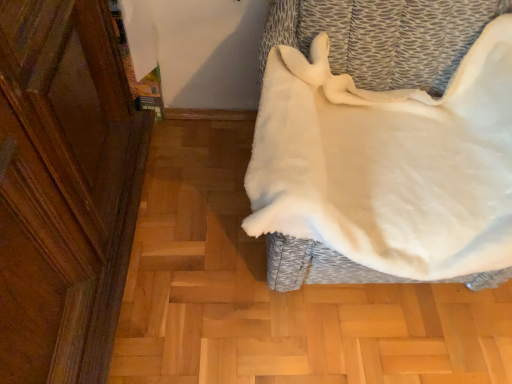
Identify the location of white soft blanket at upper right. (384, 36).

Describe the element at coordinates (384, 36) in the screenshot. I see `white soft blanket at upper right` at that location.

Measure the distance between white soft blanket at upper right and camera.

1.09 meters.

Where is `white soft blanket at upper right`? white soft blanket at upper right is located at coordinates (384, 36).